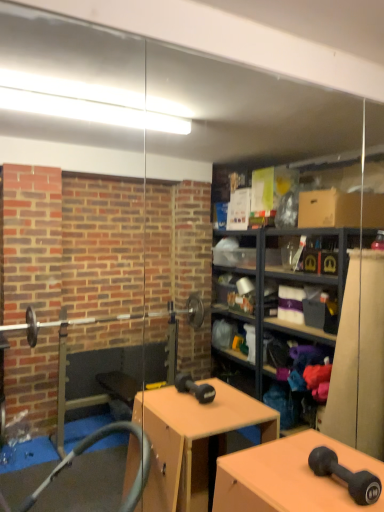
Where is `blank space situated above matte black dumbbell at center (from a real-world perspective)`? The height and width of the screenshot is (512, 384). blank space situated above matte black dumbbell at center (from a real-world perspective) is located at coordinates (291, 476).